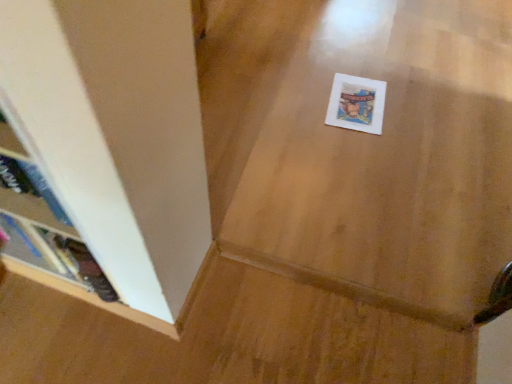
The image size is (512, 384). In order to click on free location above white paper postcard at center (from a real-world perspective) in this screenshot , I will do `click(359, 100)`.